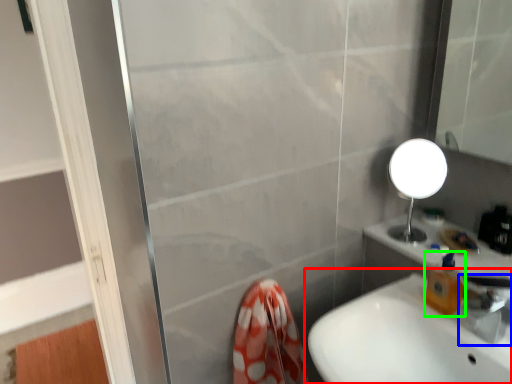
Question: Which is farther away from sink (highlighted by a red box)? tap (highlighted by a blue box) or soap dispenser (highlighted by a green box)?

Choices:
 (A) tap
 (B) soap dispenser

Answer: (A)